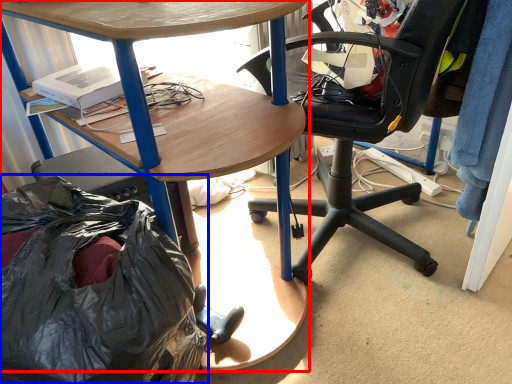
Question: Among these objects, which one is nearest to the camera, desk (highlighted by a red box) or garbage (highlighted by a blue box)?

Choices:
 (A) desk
 (B) garbage

Answer: (B)